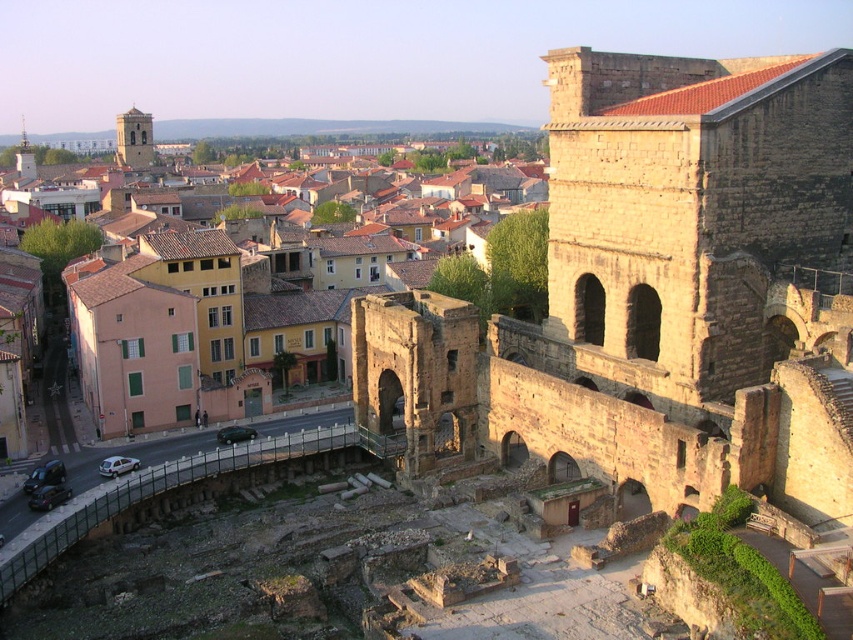
You are a tourist standing on the modern street and want to take a photo of both the brown stone ruins at upper right and the yellow stucco buildings at center. Which direction should you face to include both in your frame?

To capture both the brown stone ruins at upper right and the yellow stucco buildings at center in your photo, you should face to the right since the brown stone ruins at upper right is positioned to the right of the yellow stucco buildings at center.

You are standing in the historic urban landscape described. You want to take a photo of the yellow stucco buildings at center from a distance that allows you to capture their full facade without distortion. Considering the camera you have can focus clearly up to 100 meters, will you be able to take a clear photo from your current position?

The yellow stucco buildings at center are 87.59 meters away from the viewer. Since your camera can focus up to 100 meters, you can take a clear photo from your current position as the distance is within the camera range.